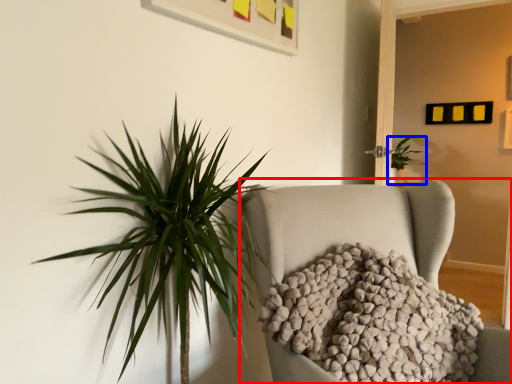
Question: Which object is closer to the camera taking this photo, furniture (highlighted by a red box) or houseplant (highlighted by a blue box)?

Choices:
 (A) furniture
 (B) houseplant

Answer: (A)